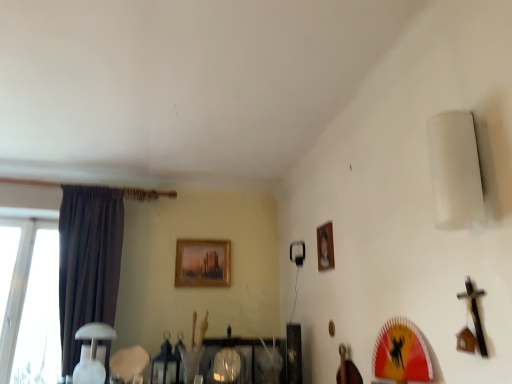
Question: Is dark fabric curtain at left outside of wooden picture frame at upper center, which appears as the 2th picture frame when viewed from the back?

Choices:
 (A) yes
 (B) no

Answer: (A)

Question: From the image's perspective, is dark fabric curtain at left located beneath wooden picture frame at upper center, the 1th picture frame in the right-to-left sequence?

Choices:
 (A) yes
 (B) no

Answer: (A)

Question: From a real-world perspective, does dark fabric curtain at left stand above wooden picture frame at upper center, the first picture frame when ordered from front to back?

Choices:
 (A) no
 (B) yes

Answer: (A)

Question: Does dark fabric curtain at left have a greater width compared to wooden picture frame at upper center, placed as the second picture frame when sorted from left to right?

Choices:
 (A) no
 (B) yes

Answer: (B)

Question: Is dark fabric curtain at left turned away from wooden picture frame at upper center, the 1th picture frame in the right-to-left sequence?

Choices:
 (A) yes
 (B) no

Answer: (B)

Question: Relative to wooden framed painting at upper center, which is counted as the first picture frame, starting from the back, is wooden picture frame at upper center, placed as the second picture frame when sorted from left to right, in front or behind?

Choices:
 (A) front
 (B) behind

Answer: (A)

Question: From the image's perspective, relative to wooden framed painting at upper center, which is counted as the first picture frame, starting from the back, is wooden picture frame at upper center, which appears as the 2th picture frame when viewed from the back, above or below?

Choices:
 (A) below
 (B) above

Answer: (B)

Question: Considering the positions of wooden picture frame at upper center, the 1th picture frame in the right-to-left sequence, and wooden framed painting at upper center, placed as the first picture frame when sorted from left to right, in the image, is wooden picture frame at upper center, the 1th picture frame in the right-to-left sequence, bigger or smaller than wooden framed painting at upper center, placed as the first picture frame when sorted from left to right,?

Choices:
 (A) small
 (B) big

Answer: (A)

Question: Is point (317, 231) positioned closer to the camera than point (226, 244)?

Choices:
 (A) closer
 (B) farther

Answer: (A)

Question: In the image, is wooden framed painting at upper center, placed as the first picture frame when sorted from left to right, positioned in front of or behind wooden picture frame at upper center, the 1th picture frame in the right-to-left sequence?

Choices:
 (A) front
 (B) behind

Answer: (B)

Question: Looking at the image, does wooden framed painting at upper center, placed as the first picture frame when sorted from left to right, seem bigger or smaller compared to wooden picture frame at upper center, placed as the second picture frame when sorted from left to right?

Choices:
 (A) big
 (B) small

Answer: (A)

Question: Considering the relative positions of wooden framed painting at upper center, which is counted as the first picture frame, starting from the back, and wooden picture frame at upper center, the 1th picture frame in the right-to-left sequence, in the image provided, is wooden framed painting at upper center, which is counted as the first picture frame, starting from the back, to the left or to the right of wooden picture frame at upper center, the 1th picture frame in the right-to-left sequence,?

Choices:
 (A) left
 (B) right

Answer: (A)

Question: In terms of width, does wooden framed painting at upper center, the second picture frame from the right, look wider or thinner when compared to wooden picture frame at upper center, placed as the second picture frame when sorted from left to right?

Choices:
 (A) wide
 (B) thin

Answer: (A)

Question: Considering the relative positions of dark fabric curtain at left and white glossy table lamp at lower left in the image provided, is dark fabric curtain at left to the left or to the right of white glossy table lamp at lower left?

Choices:
 (A) left
 (B) right

Answer: (A)

Question: Is point (x=91, y=278) closer or farther from the camera than point (x=102, y=377)?

Choices:
 (A) closer
 (B) farther

Answer: (B)